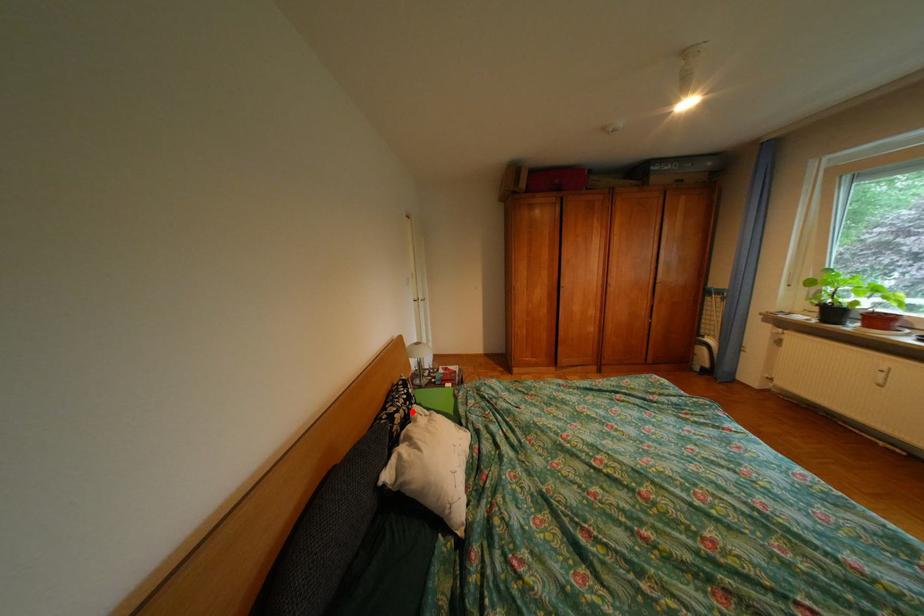
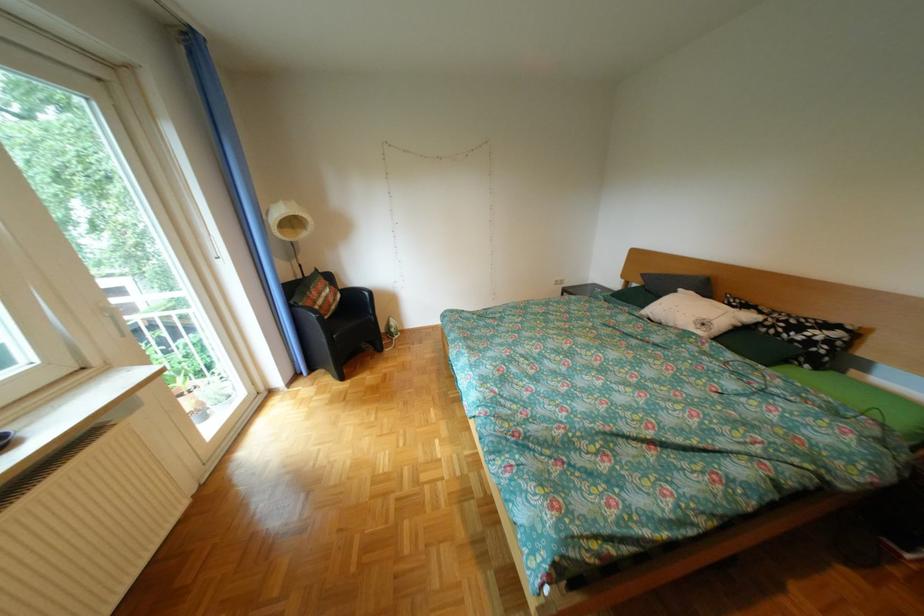
In the second image, find the point that corresponds to the highlighted location in the first image.

(775, 313)